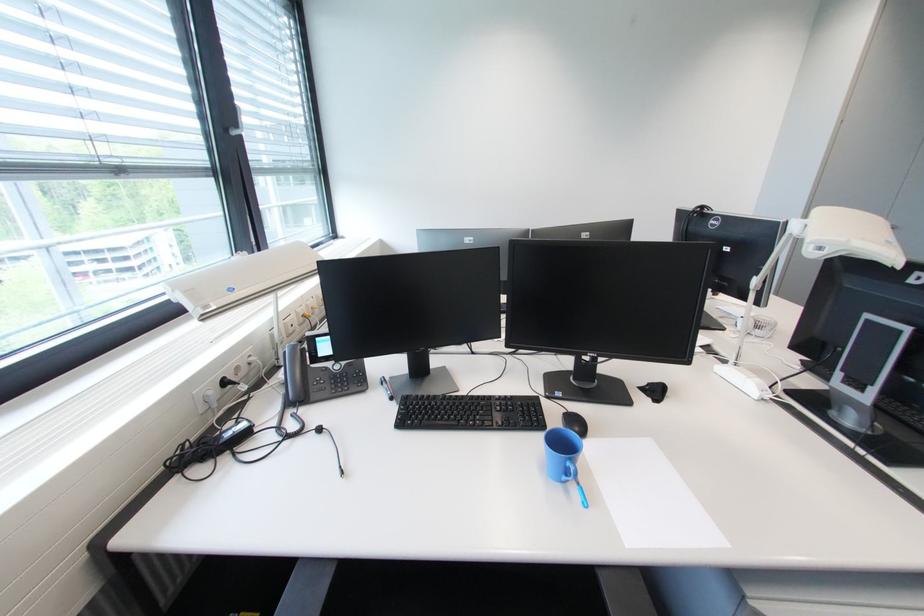
Which object does [575,423] point to?

It corresponds to the black computer mouse in the image.